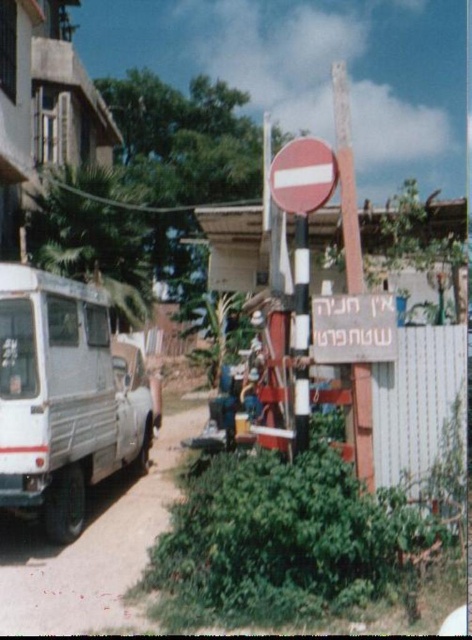
Question: Which of these objects is positioned farthest from the white striped pole at center?

Choices:
 (A) smooth wooden signpost at center
 (B) white matte van at left
 (C) white plastic sign at center

Answer: (B)

Question: Can you confirm if white matte van at left is smaller than smooth red circle at center?

Choices:
 (A) no
 (B) yes

Answer: (A)

Question: Which object is the closest to the smooth red circle at center?

Choices:
 (A) white matte van at left
 (B) white striped pole at center
 (C) smooth wooden signpost at center
 (D) white plastic sign at center

Answer: (D)

Question: Among these objects, which one is nearest to the camera?

Choices:
 (A) smooth wooden signpost at center
 (B) white matte van at left
 (C) smooth red circle at center
 (D) white striped pole at center

Answer: (A)

Question: Can you confirm if smooth wooden signpost at center is positioned above white striped pole at center?

Choices:
 (A) yes
 (B) no

Answer: (A)

Question: Can you confirm if smooth wooden signpost at center is wider than smooth red circle at center?

Choices:
 (A) yes
 (B) no

Answer: (A)